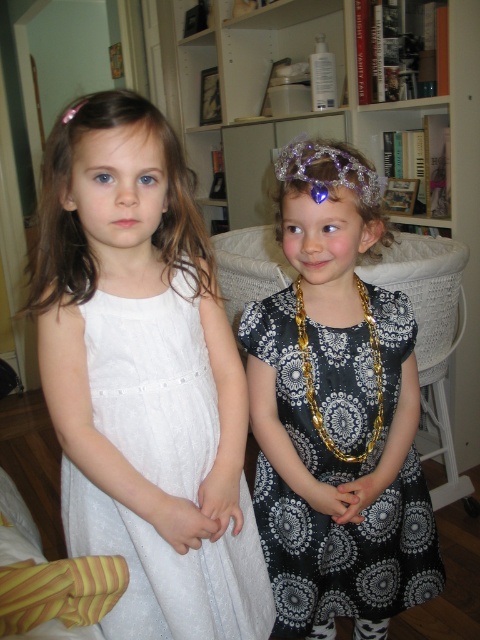
Question: From the image, what is the correct spatial relationship of black satin dress at center in relation to sparkly silver tiara at upper right?

Choices:
 (A) right
 (B) left

Answer: (A)

Question: Which point is farther to the camera?

Choices:
 (A) sparkly silver tiara at upper right
 (B) white lace dress at left
 (C) silver glitter tiara at upper center

Answer: (A)

Question: Which point is farther to the camera?

Choices:
 (A) white lace dress at left
 (B) black satin dress at center
 (C) silver glitter tiara at upper center
 (D) gold chain necklace at center

Answer: (D)

Question: In this image, where is white lace dress at left located relative to gold chain necklace at center?

Choices:
 (A) below
 (B) above

Answer: (A)

Question: Considering the real-world distances, which object is closest to the white lace dress at left?

Choices:
 (A) black satin dress at center
 (B) sparkly silver tiara at upper right

Answer: (A)

Question: Can you confirm if white lace dress at left is positioned above gold chain necklace at center?

Choices:
 (A) no
 (B) yes

Answer: (A)